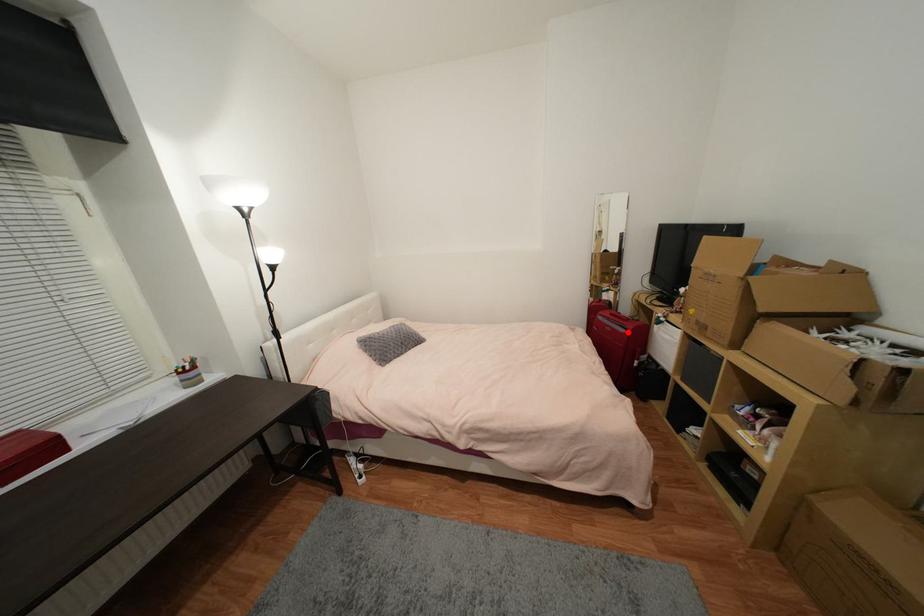
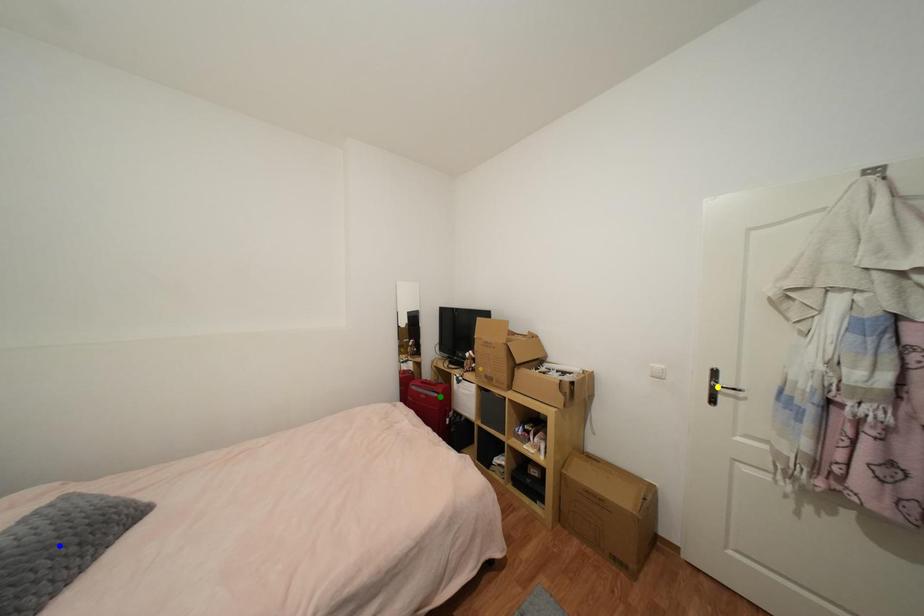
Question: I am providing you with two images of the same scene from different viewpoints. A red point is marked on the first image. You are given multiple points on the second image. Which spot in image 2 lines up with the point in image 1?

Choices:
 (A) blue point
 (B) yellow point
 (C) green point

Answer: (C)